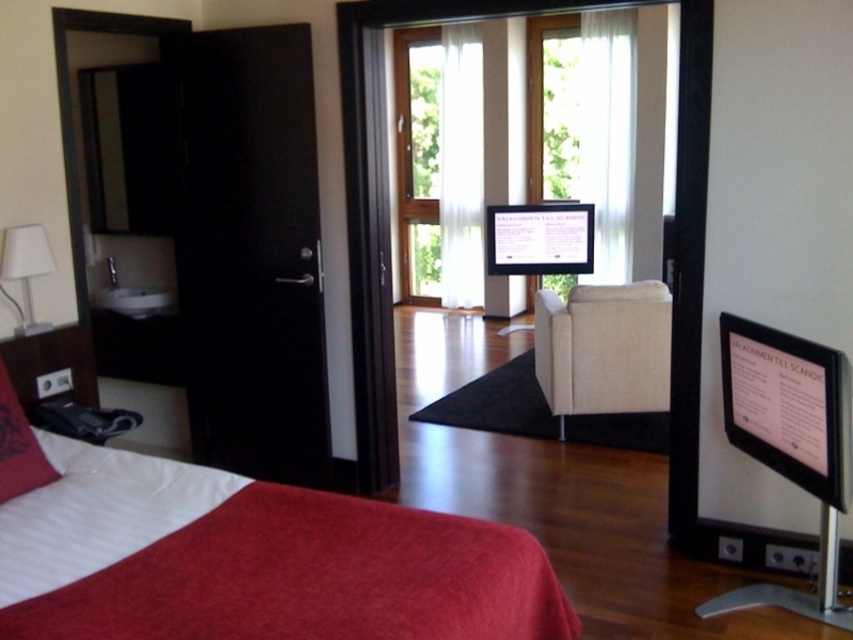
Which is in front, point (693, 44) or point (7, 428)?

Positioned in front is point (7, 428).

Find the location of a particular element. transparent glass door at center is located at coordinates (381, 218).

Is point (370, 401) farther from viewer compared to point (22, 435)?

Yes, point (370, 401) is farther from viewer.

Locate an element on the screen. The width and height of the screenshot is (853, 640). transparent glass door at center is located at coordinates (381, 218).

Is velvet red bed at lower left shorter than velvet red pillow at lower left?

In fact, velvet red bed at lower left may be taller than velvet red pillow at lower left.

Who is more distant from viewer, (245,604) or (32,445)?

Positioned behind is point (32,445).

Between point (144, 577) and point (38, 442), which one is positioned in front?

Point (144, 577) is more forward.

This screenshot has height=640, width=853. I want to click on velvet red bed at lower left, so click(242, 556).

Does point (699, 275) come behind point (4, 248)?

Yes, it is.

Is transparent glass door at center bigger than white fabric lampshade at left?

Yes, transparent glass door at center is bigger than white fabric lampshade at left.

Does point (676, 362) lie behind point (32, 301)?

Yes, point (676, 362) is farther from viewer.

Where is `transparent glass door at center`? This screenshot has height=640, width=853. transparent glass door at center is located at coordinates (381, 218).